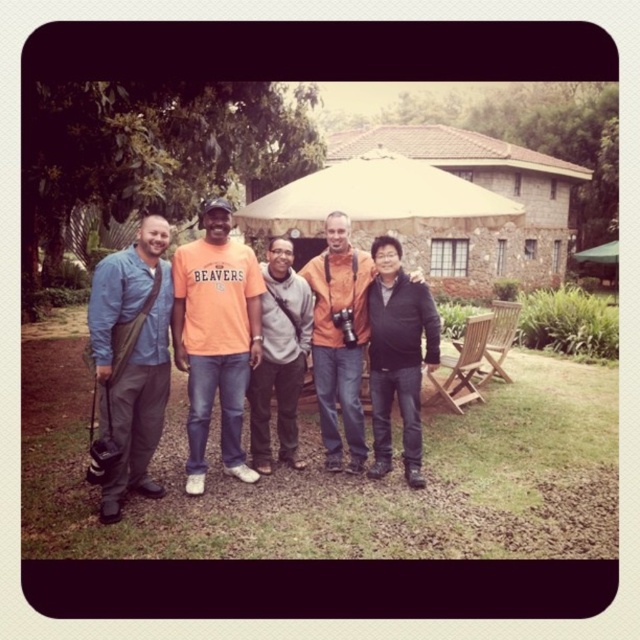
You are a photographer trying to capture a group photo of the matte blue shirt at left and orange cotton shirt at center. Which person should you position closer to the camera to ensure both appear equally tall in the photo?

The orange cotton shirt at center should be positioned closer to the camera because the matte blue shirt at left is much taller, so moving the shorter orange cotton shirt at center forward will balance their apparent heights in the photo.

You are trying to locate the black matte jacket at center and the orange cotton shirt at center in the group photo. According to the scene description, which one is positioned to the right of the other?

The black matte jacket at center is positioned to the right of the orange cotton shirt at center.

You are a photographer trying to capture a group photo of the black matte jacket at center and the orange cotton shirt at center. Since both are at the center, how can you position your camera to ensure both are clearly visible in the photo?

The black matte jacket at center is located below the orange cotton shirt at center. To ensure both are visible, position the camera so it captures the orange cotton shirt at center above and the black matte jacket at center below in the frame.